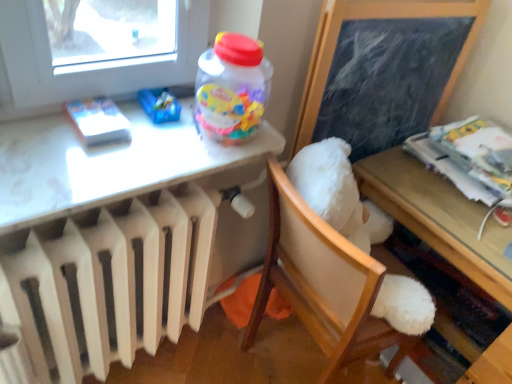
Find the location of a particular element. free space in front of white matte book at upper left, marked as the first magazine in a front-to-back arrangement is located at coordinates 73,171.